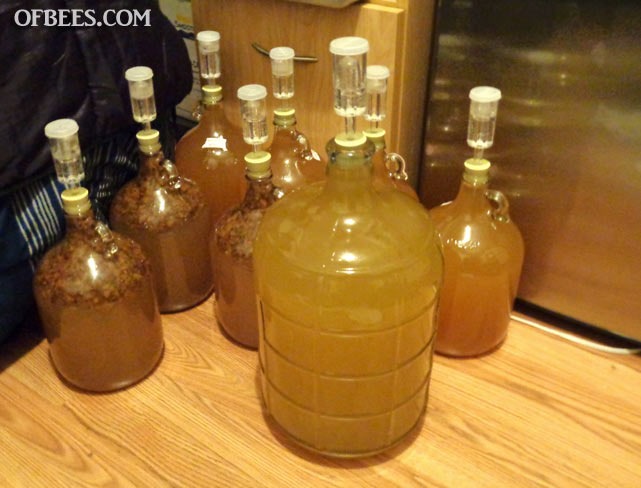
Image resolution: width=641 pixels, height=488 pixels. I want to click on bottle, so click(x=386, y=433).